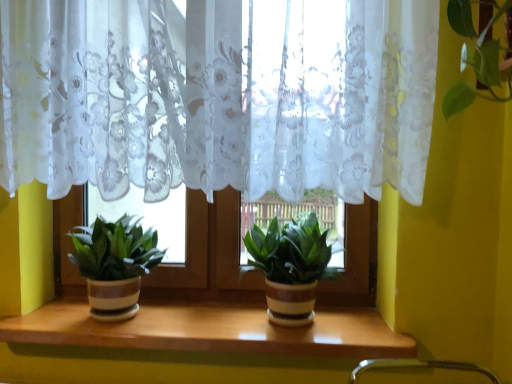
Question: From a real-world perspective, is green matte plant pot at left, which is the second houseplant in right-to-left order, above or below green matte plant pot at center, the first houseplant in the right-to-left sequence?

Choices:
 (A) above
 (B) below

Answer: (A)

Question: Is green matte plant pot at left, which is the second houseplant in right-to-left order, spatially inside green matte plant pot at center, positioned as the 2th houseplant in left-to-right order, or outside of it?

Choices:
 (A) inside
 (B) outside

Answer: (B)

Question: Considering the real-world distances, which object is closest to the white lace curtain at upper center?

Choices:
 (A) green matte plant pot at center, positioned as the 2th houseplant in left-to-right order
 (B) green matte plant pot at left, which is the second houseplant in right-to-left order
 (C) wooden at center

Answer: (A)

Question: Considering the real-world distances, which object is farthest from the white lace curtain at upper center?

Choices:
 (A) green matte plant pot at center, positioned as the 2th houseplant in left-to-right order
 (B) green matte plant pot at left, which is the second houseplant in right-to-left order
 (C) wooden at center

Answer: (C)